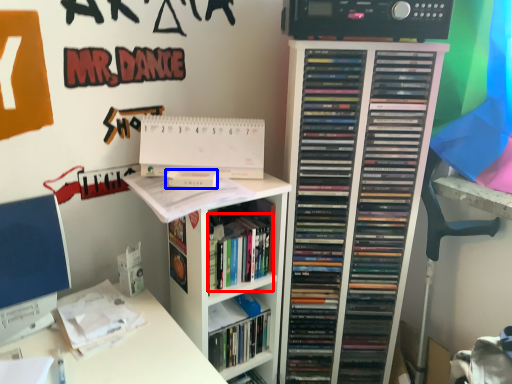
Question: Which point is further to the camera, book (highlighted by a red box) or paperback book (highlighted by a blue box)?

Choices:
 (A) book
 (B) paperback book

Answer: (B)